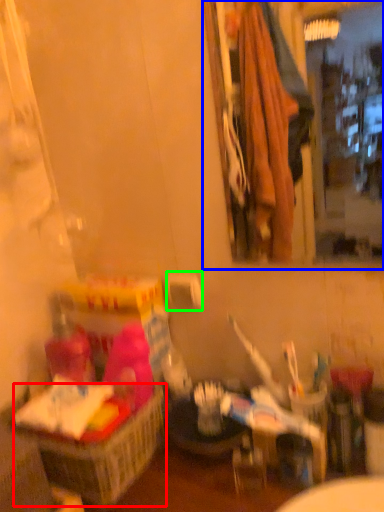
Question: Which object is the farthest from basket (highlighted by a red box)? Choose among these: mirror (highlighted by a blue box) or toilet paper (highlighted by a green box).

Choices:
 (A) mirror
 (B) toilet paper

Answer: (A)